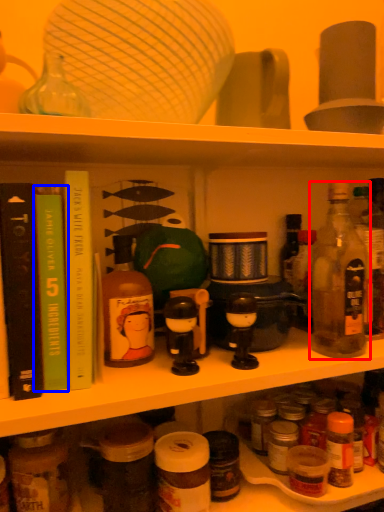
Question: Among these objects, which one is nearest to the camera, bottle (highlighted by a red box) or book (highlighted by a blue box)?

Choices:
 (A) bottle
 (B) book

Answer: (B)